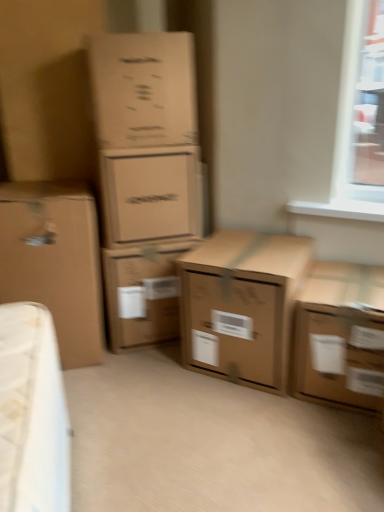
Locate an element on the screen. This screenshot has height=512, width=384. matte cardboard box at center, marked as the 3th box in a left-to-right arrangement is located at coordinates (150, 194).

This screenshot has height=512, width=384. Describe the element at coordinates (143, 89) in the screenshot. I see `brown cardboard box at upper left, the second box viewed from the left` at that location.

Where is `brown cardboard box at upper left, marked as the 5th box in a right-to-left arrangement`? brown cardboard box at upper left, marked as the 5th box in a right-to-left arrangement is located at coordinates (143, 89).

In order to face brown cardboard box at center, the fifth box in the left-to-right sequence, should I rotate leftwards or rightwards?

Rotate right and turn 7.612 degrees.

What do you see at coordinates (143, 293) in the screenshot? The width and height of the screenshot is (384, 512). I see `brown cardboard box at center, the third box positioned from the right` at bounding box center [143, 293].

Identify the location of brown cardboard box at lower right, which appears as the sixth box when viewed from the left. The image size is (384, 512). (341, 337).

Locate an element on the screen. box that is the 5th object directly below the brown cardboard box at upper left, marked as the 5th box in a right-to-left arrangement (from a real-world perspective) is located at coordinates (341, 337).

Considering the sizes of objects brown cardboard box at upper left, marked as the 5th box in a right-to-left arrangement, and brown cardboard box at lower right, which appears as the sixth box when viewed from the left, in the image provided, who is wider, brown cardboard box at upper left, marked as the 5th box in a right-to-left arrangement, or brown cardboard box at lower right, which appears as the sixth box when viewed from the left,?

With larger width is brown cardboard box at upper left, marked as the 5th box in a right-to-left arrangement.

Is brown cardboard box at upper left, the second box viewed from the left, turned away from brown cardboard box at lower right, the 1th box positioned from the right?

brown cardboard box at upper left, the second box viewed from the left, is not turned away from brown cardboard box at lower right, the 1th box positioned from the right.

From a real-world perspective, is brown cardboard box at upper left, marked as the 5th box in a right-to-left arrangement, positioned above or below brown cardboard box at lower right, which appears as the sixth box when viewed from the left?

brown cardboard box at upper left, marked as the 5th box in a right-to-left arrangement, is above brown cardboard box at lower right, which appears as the sixth box when viewed from the left.

Considering the relative sizes of matte cardboard box at center, marked as the 3th box in a left-to-right arrangement, and brown cardboard box at upper left, the second box viewed from the left, in the image provided, is matte cardboard box at center, marked as the 3th box in a left-to-right arrangement, bigger than brown cardboard box at upper left, the second box viewed from the left,?

Actually, matte cardboard box at center, marked as the 3th box in a left-to-right arrangement, might be smaller than brown cardboard box at upper left, the second box viewed from the left.

Considering the relative sizes of matte cardboard box at center, the fourth box when ordered from right to left, and brown cardboard box at upper left, the second box viewed from the left, in the image provided, is matte cardboard box at center, the fourth box when ordered from right to left, wider than brown cardboard box at upper left, the second box viewed from the left,?

Incorrect, the width of matte cardboard box at center, the fourth box when ordered from right to left, does not surpass that of brown cardboard box at upper left, the second box viewed from the left.

Is matte cardboard box at center, marked as the 3th box in a left-to-right arrangement, situated inside brown cardboard box at upper left, marked as the 5th box in a right-to-left arrangement, or outside?

matte cardboard box at center, marked as the 3th box in a left-to-right arrangement, is not enclosed by brown cardboard box at upper left, marked as the 5th box in a right-to-left arrangement.

Does matte cardboard box at center, marked as the 3th box in a left-to-right arrangement, appear on the right side of brown cardboard box at upper left, marked as the 5th box in a right-to-left arrangement?

Yes, matte cardboard box at center, marked as the 3th box in a left-to-right arrangement, is to the right of brown cardboard box at upper left, marked as the 5th box in a right-to-left arrangement.

Considering the points (74, 329) and (321, 264), which point is behind, point (74, 329) or point (321, 264)?

The point (321, 264) is farther from the camera.

Would you say brown cardboard box at left, which is counted as the sixth box, starting from the right, is inside or outside brown cardboard box at lower right, which appears as the sixth box when viewed from the left?

brown cardboard box at left, which is counted as the sixth box, starting from the right, is not enclosed by brown cardboard box at lower right, which appears as the sixth box when viewed from the left.

Based on the photo, from a real-world perspective, between brown cardboard box at left, positioned as the first box in left-to-right order, and brown cardboard box at lower right, the 1th box positioned from the right, who is vertically higher?

From a 3D spatial view, brown cardboard box at left, positioned as the first box in left-to-right order, is above.

Can you confirm if brown cardboard box at left, positioned as the first box in left-to-right order, is thinner than brown cardboard box at lower right, which appears as the sixth box when viewed from the left?

In fact, brown cardboard box at left, positioned as the first box in left-to-right order, might be wider than brown cardboard box at lower right, which appears as the sixth box when viewed from the left.

How much distance is there between brown cardboard box at left, positioned as the first box in left-to-right order, and matte cardboard box at center, the fourth box when ordered from right to left?

brown cardboard box at left, positioned as the first box in left-to-right order, is 11.49 inches from matte cardboard box at center, the fourth box when ordered from right to left.

Is brown cardboard box at left, positioned as the first box in left-to-right order, next to matte cardboard box at center, marked as the 3th box in a left-to-right arrangement, and touching it?

No, brown cardboard box at left, positioned as the first box in left-to-right order, is not with matte cardboard box at center, marked as the 3th box in a left-to-right arrangement.

From the picture: Which of these two, brown cardboard box at left, positioned as the first box in left-to-right order, or matte cardboard box at center, the fourth box when ordered from right to left, is thinner?

matte cardboard box at center, the fourth box when ordered from right to left, is thinner.

From the image's perspective, which object appears higher, brown cardboard box at left, positioned as the first box in left-to-right order, or matte cardboard box at center, the fourth box when ordered from right to left?

From the image's view, matte cardboard box at center, the fourth box when ordered from right to left, is above.

From the image's perspective, between brown cardboard box at left, positioned as the first box in left-to-right order, and brown cardboard box at center, positioned as the 2th box in right-to-left order, who is located below?

brown cardboard box at center, positioned as the 2th box in right-to-left order, appears lower in the image.

Between brown cardboard box at left, positioned as the first box in left-to-right order, and brown cardboard box at center, positioned as the 2th box in right-to-left order, which one is positioned behind?

brown cardboard box at left, positioned as the first box in left-to-right order, is behind.

Which box is the 2nd one when counting from the front of the brown cardboard box at left, positioned as the first box in left-to-right order? Please provide its 2D coordinates.

[(242, 305)]

From a real-world perspective, which object rests below the other?

matte cardboard box at center, marked as the 3th box in a left-to-right arrangement, is physically lower.

In the scene shown: Is brown cardboard box at upper left, the second box viewed from the left, wider or thinner than matte cardboard box at center, the fourth box when ordered from right to left?

In the image, brown cardboard box at upper left, the second box viewed from the left, appears to be wider than matte cardboard box at center, the fourth box when ordered from right to left.

Identify the location of box that is the 2nd one when counting forward from the matte cardboard box at center, the fourth box when ordered from right to left. This screenshot has width=384, height=512. (143, 89).

Is brown cardboard box at upper left, marked as the 5th box in a right-to-left arrangement, spatially inside matte cardboard box at center, the fourth box when ordered from right to left, or outside of it?

brown cardboard box at upper left, marked as the 5th box in a right-to-left arrangement, is not enclosed by matte cardboard box at center, the fourth box when ordered from right to left.

Could you measure the distance between brown cardboard box at upper left, marked as the 5th box in a right-to-left arrangement, and brown cardboard box at center, the fifth box in the left-to-right sequence?

brown cardboard box at upper left, marked as the 5th box in a right-to-left arrangement, is 28.45 inches away from brown cardboard box at center, the fifth box in the left-to-right sequence.

Between point (121, 141) and point (234, 377), which one is positioned behind?

Point (234, 377)

Considering the sizes of objects brown cardboard box at upper left, the second box viewed from the left, and brown cardboard box at center, the fifth box in the left-to-right sequence, in the image provided, who is shorter, brown cardboard box at upper left, the second box viewed from the left, or brown cardboard box at center, the fifth box in the left-to-right sequence,?

brown cardboard box at upper left, the second box viewed from the left.

Is brown cardboard box at upper left, the second box viewed from the left, touching brown cardboard box at center, the fifth box in the left-to-right sequence?

No, brown cardboard box at upper left, the second box viewed from the left, is not touching brown cardboard box at center, the fifth box in the left-to-right sequence.

At what (x,y) coordinates should I click in order to perform the action: click on the 4th box to the right of the brown cardboard box at upper left, marked as the 5th box in a right-to-left arrangement, counting from the anchor's position. Please return your answer as a coordinate pair (x, y). The image size is (384, 512). Looking at the image, I should click on [x=341, y=337].

From the matte cardboard box at center, marked as the 3th box in a left-to-right arrangement, count the 1st box to the left and point to it. Please provide its 2D coordinates.

[(143, 89)]

From the image, which object appears to be nearer to matte cardboard box at center, the fourth box when ordered from right to left, brown cardboard box at left, positioned as the first box in left-to-right order, or brown cardboard box at upper left, the second box viewed from the left?

brown cardboard box at upper left, the second box viewed from the left, is closer to matte cardboard box at center, the fourth box when ordered from right to left.

Which object lies nearer to the anchor point brown cardboard box at left, which is counted as the sixth box, starting from the right, brown cardboard box at upper left, the second box viewed from the left, or brown cardboard box at lower right, the 1th box positioned from the right?

brown cardboard box at upper left, the second box viewed from the left, is closer to brown cardboard box at left, which is counted as the sixth box, starting from the right.

When comparing their distances from brown cardboard box at upper left, the second box viewed from the left, does brown cardboard box at center, the 4th box from the left, or brown cardboard box at center, the fifth box in the left-to-right sequence, seem closer?

The object closer to brown cardboard box at upper left, the second box viewed from the left, is brown cardboard box at center, the 4th box from the left.

Which object lies further to the anchor point brown cardboard box at upper left, marked as the 5th box in a right-to-left arrangement, brown cardboard box at center, positioned as the 2th box in right-to-left order, or brown cardboard box at center, the third box positioned from the right?

brown cardboard box at center, positioned as the 2th box in right-to-left order.

Looking at the image, which one is located closer to brown cardboard box at upper left, marked as the 5th box in a right-to-left arrangement, brown cardboard box at left, which is counted as the sixth box, starting from the right, or brown cardboard box at center, the fifth box in the left-to-right sequence?

brown cardboard box at left, which is counted as the sixth box, starting from the right.

From the image, which object appears to be nearer to brown cardboard box at left, positioned as the first box in left-to-right order, brown cardboard box at lower right, which appears as the sixth box when viewed from the left, or brown cardboard box at center, positioned as the 2th box in right-to-left order?

The object closer to brown cardboard box at left, positioned as the first box in left-to-right order, is brown cardboard box at center, positioned as the 2th box in right-to-left order.

Which object lies further to the anchor point brown cardboard box at center, the third box positioned from the right, brown cardboard box at left, positioned as the first box in left-to-right order, or brown cardboard box at upper left, the second box viewed from the left?

The object further to brown cardboard box at center, the third box positioned from the right, is brown cardboard box at upper left, the second box viewed from the left.

Considering their positions, is brown cardboard box at center, positioned as the 2th box in right-to-left order, positioned closer to brown cardboard box at upper left, the second box viewed from the left, than matte cardboard box at center, marked as the 3th box in a left-to-right arrangement?

matte cardboard box at center, marked as the 3th box in a left-to-right arrangement, lies closer to brown cardboard box at upper left, the second box viewed from the left, than the other object.

Find the location of a particular element. The image size is (384, 512). box situated between brown cardboard box at center, the 4th box from the left, and brown cardboard box at lower right, the 1th box positioned from the right, from left to right is located at coordinates (242, 305).

This screenshot has height=512, width=384. In order to click on box between brown cardboard box at upper left, marked as the 5th box in a right-to-left arrangement, and brown cardboard box at left, which is counted as the sixth box, starting from the right, in the vertical direction in this screenshot , I will do `click(150, 194)`.